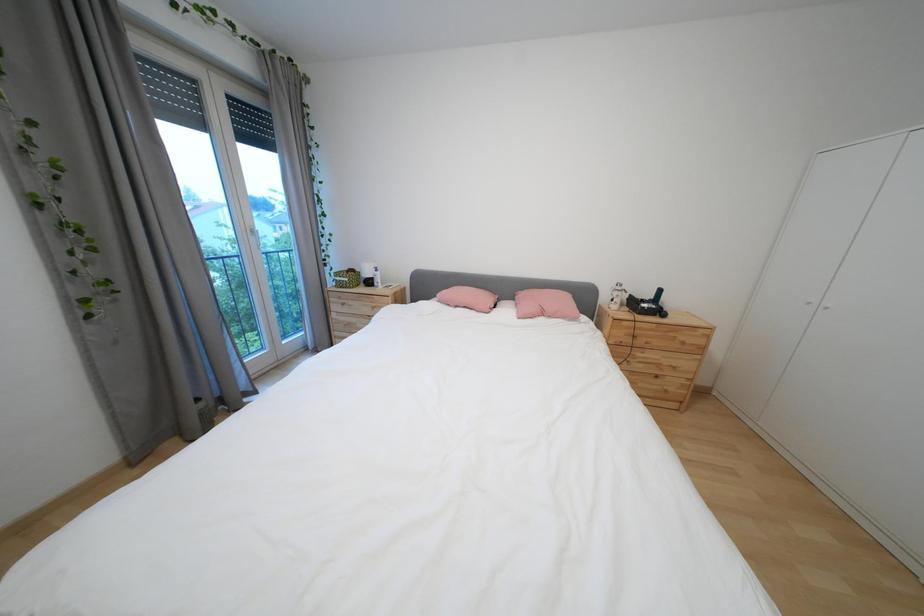
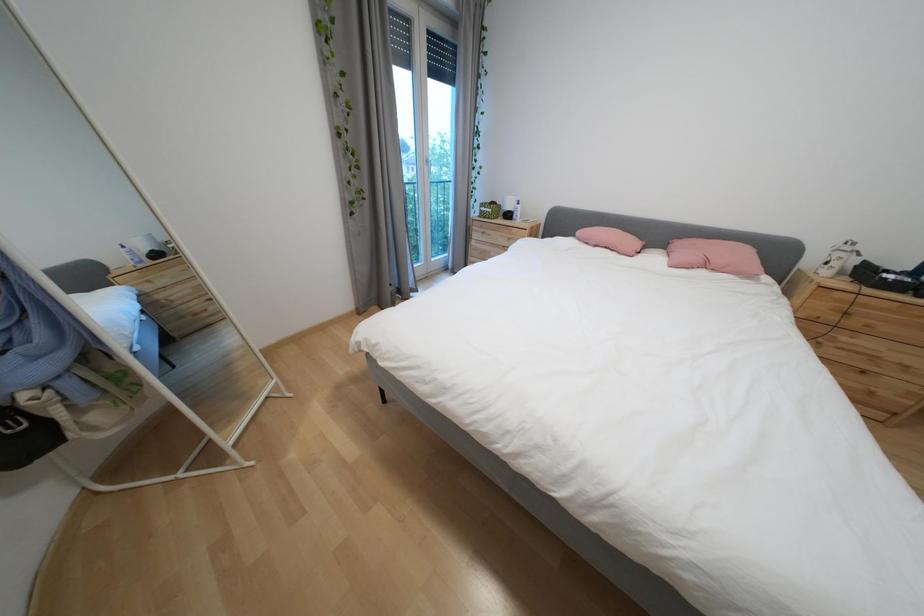
What movement of the cameraman would produce the second image?

The cameraman walked toward left, backward.